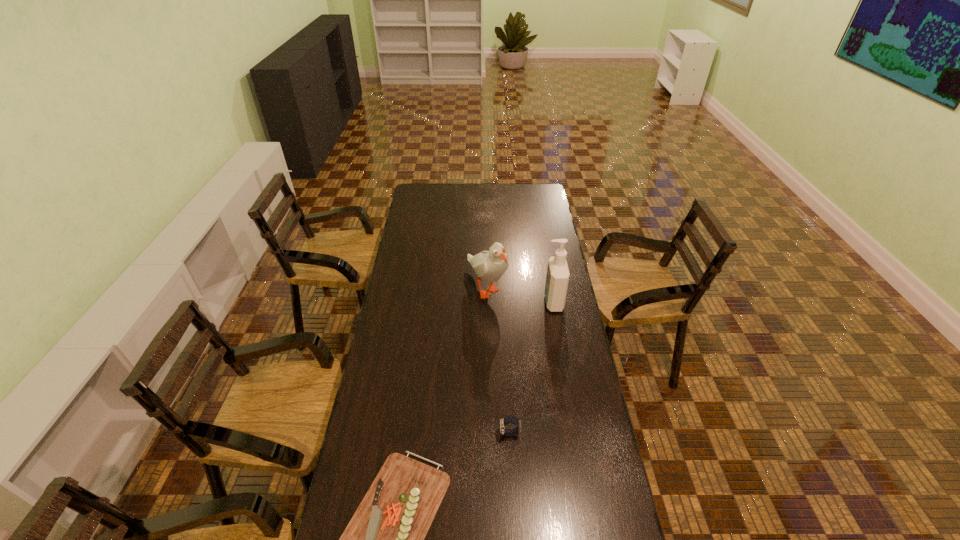
Find the location of a particular element. blank area located 0.260m on the face of the second nearest object is located at coordinates (421, 434).

This screenshot has height=540, width=960. Identify the location of object that is at the right edge. (557, 278).

In the image, there is a desktop. Identify the location of vacant space at the far edge. (504, 204).

This screenshot has height=540, width=960. Identify the location of blank space at the left edge of the desktop. (394, 333).

Identify the location of vacant space at the right edge of the desktop. This screenshot has height=540, width=960. tap(533, 235).

Locate an element on the screen. free spot at the far right corner of the desktop is located at coordinates (542, 197).

This screenshot has height=540, width=960. Find the location of `free space that is in between the gull and the cleansing agent`. free space that is in between the gull and the cleansing agent is located at coordinates (519, 294).

This screenshot has width=960, height=540. What are the coordinates of `vacant space that's between the cleansing agent and the third farthest object` in the screenshot? It's located at (531, 368).

Find the location of a particular element. This screenshot has height=540, width=960. free point between the watch and the rightmost object is located at coordinates (531, 368).

This screenshot has width=960, height=540. I want to click on unoccupied area between the watch and the gull, so 498,360.